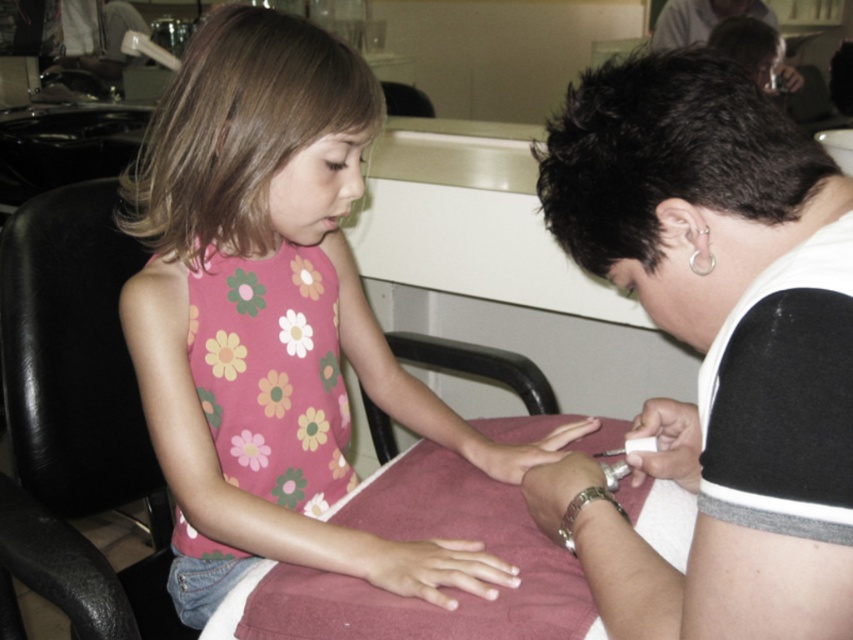
Can you confirm if matte white shirt at lower right is wider than black leather chair at left?

In fact, matte white shirt at lower right might be narrower than black leather chair at left.

Is point (619, 90) less distant than point (67, 355)?

Yes, it is.

This screenshot has width=853, height=640. In order to click on matte white shirt at lower right in this screenshot , I will do `click(682, 186)`.

How far apart are white matte nails at center and white matte nail file at center?

The distance of white matte nails at center from white matte nail file at center is 23.45 centimeters.

Does white matte nails at center have a lesser width compared to white matte nail file at center?

No, white matte nails at center is not thinner than white matte nail file at center.

Which is behind, point (403, 579) or point (683, 464)?

The point (683, 464) is behind.

Image resolution: width=853 pixels, height=640 pixels. I want to click on white matte nails at center, so click(x=428, y=566).

Measure the distance between white matte nails at center and silver metallic bracelet at lower center.

They are 3.91 inches apart.

Can you confirm if white matte nails at center is thinner than silver metallic bracelet at lower center?

No, white matte nails at center is not thinner than silver metallic bracelet at lower center.

Between point (375, 561) and point (572, 536), which one is positioned behind?

The point (375, 561) is behind.

You are a GUI agent. You are given a task and a screenshot of the screen. Output one action in this format:
    pyautogui.click(x=<x>, y=<y>)
    Task: Click on the white matte nails at center
    This screenshot has height=640, width=853.
    Given the screenshot: What is the action you would take?
    pyautogui.click(x=428, y=566)